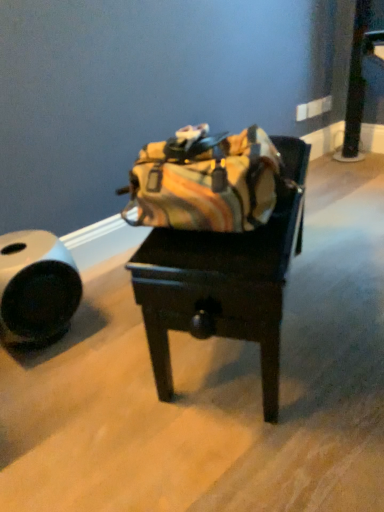
The width and height of the screenshot is (384, 512). Identify the location of free point to the right of white matte tube at left. (108, 331).